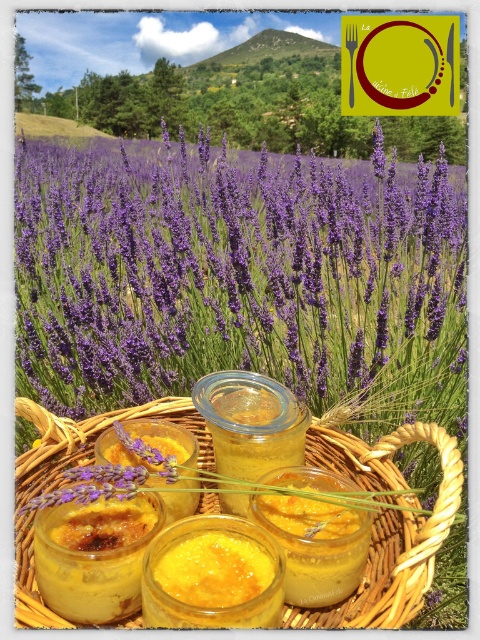
Question: Based on their relative distances, which object is farther from the woven straw basket at center?

Choices:
 (A) purple matte lavender at center
 (B) transparent glass jar at center
 (C) yellow translucent mustard at center

Answer: (A)

Question: In this image, where is woven straw basket at center located relative to yellow translucent mustard at center?

Choices:
 (A) right
 (B) left

Answer: (B)

Question: Can you confirm if purple matte lavender at center is bigger than yellow translucent mustard at center?

Choices:
 (A) yes
 (B) no

Answer: (A)

Question: Does yellow translucent mustard at center have a lesser width compared to transparent glass jar at center?

Choices:
 (A) yes
 (B) no

Answer: (A)

Question: Which object is the farthest from the woven straw basket at center?

Choices:
 (A) purple matte lavender at center
 (B) yellow translucent mustard at center
 (C) transparent glass jar at center

Answer: (A)

Question: Based on their relative distances, which object is farther from the yellow translucent mustard at center?

Choices:
 (A) purple matte lavender at center
 (B) transparent glass jar at center

Answer: (A)